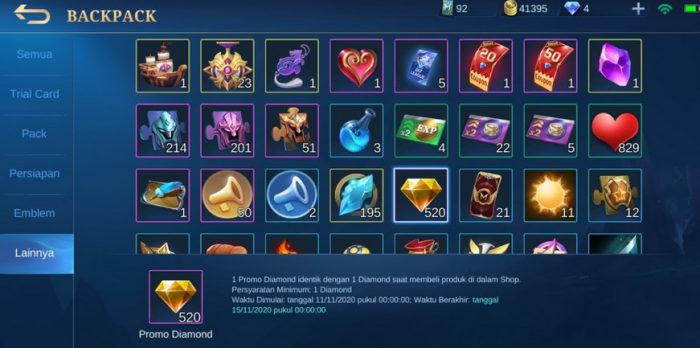
I want to click on bottle, so click(491, 198), click(360, 135).